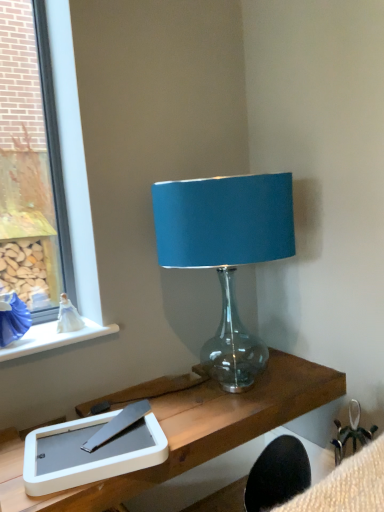
Question: Is teal fabric lampshade at upper center shorter than clear glass window at left?

Choices:
 (A) no
 (B) yes

Answer: (B)

Question: From a real-world perspective, does teal fabric lampshade at upper center stand above clear glass window at left?

Choices:
 (A) yes
 (B) no

Answer: (B)

Question: Is teal fabric lampshade at upper center facing away from clear glass window at left?

Choices:
 (A) yes
 (B) no

Answer: (B)

Question: Is teal fabric lampshade at upper center positioned in front of clear glass window at left?

Choices:
 (A) no
 (B) yes

Answer: (B)

Question: Can you confirm if teal fabric lampshade at upper center is wider than clear glass window at left?

Choices:
 (A) no
 (B) yes

Answer: (B)

Question: Based on their sizes in the image, would you say white ceramic window sill at upper left is bigger or smaller than white matte tablet at lower left?

Choices:
 (A) big
 (B) small

Answer: (B)

Question: Does point (46, 339) appear closer or farther from the camera than point (140, 425)?

Choices:
 (A) closer
 (B) farther

Answer: (B)

Question: From their relative heights in the image, would you say white ceramic window sill at upper left is taller or shorter than white matte tablet at lower left?

Choices:
 (A) short
 (B) tall

Answer: (A)

Question: From the image's perspective, is white ceramic window sill at upper left above or below white matte tablet at lower left?

Choices:
 (A) below
 (B) above

Answer: (B)

Question: Is point (137, 457) positioned closer to the camera than point (77, 238)?

Choices:
 (A) farther
 (B) closer

Answer: (B)

Question: Looking at the image, does white matte tablet at lower left seem bigger or smaller compared to clear glass window at left?

Choices:
 (A) small
 (B) big

Answer: (A)

Question: From a real-world perspective, relative to clear glass window at left, is white matte tablet at lower left vertically above or below?

Choices:
 (A) above
 (B) below

Answer: (B)

Question: Relative to clear glass window at left, is white matte tablet at lower left in front or behind?

Choices:
 (A) front
 (B) behind

Answer: (A)

Question: Based on their positions, is clear glass window at left located to the left or right of white ceramic window sill at upper left?

Choices:
 (A) right
 (B) left

Answer: (B)

Question: In terms of height, does clear glass window at left look taller or shorter compared to white ceramic window sill at upper left?

Choices:
 (A) tall
 (B) short

Answer: (A)